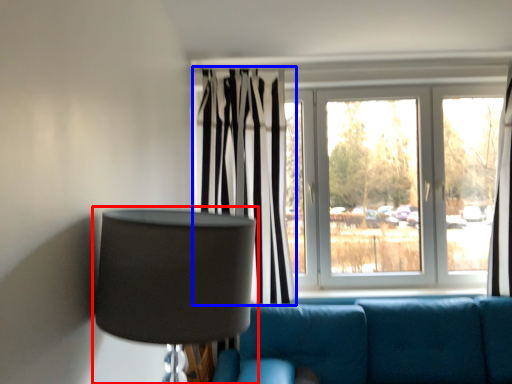
Question: Which object is further to the camera taking this photo, lamp (highlighted by a red box) or curtain (highlighted by a blue box)?

Choices:
 (A) lamp
 (B) curtain

Answer: (B)